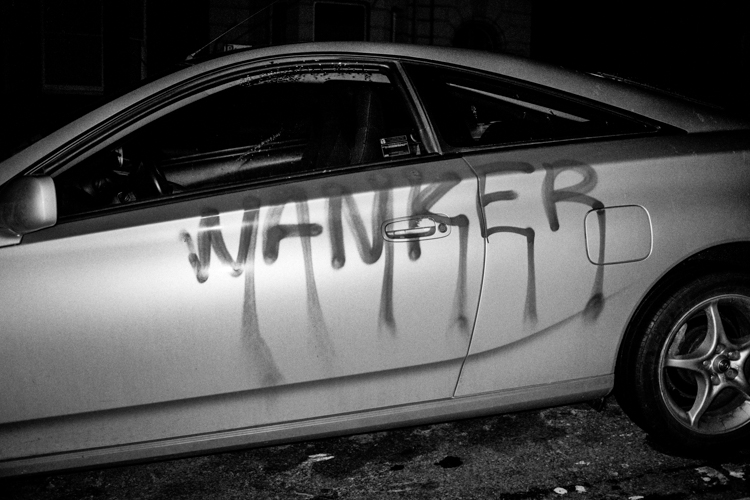
You are a GUI agent. You are given a task and a screenshot of the screen. Output one action in this format:
    pyautogui.click(x=<x>, y=<y>)
    Task: Click on the door handle
    Image resolution: width=750 pixels, height=500 pixels.
    Given the screenshot: What is the action you would take?
    (398, 228)